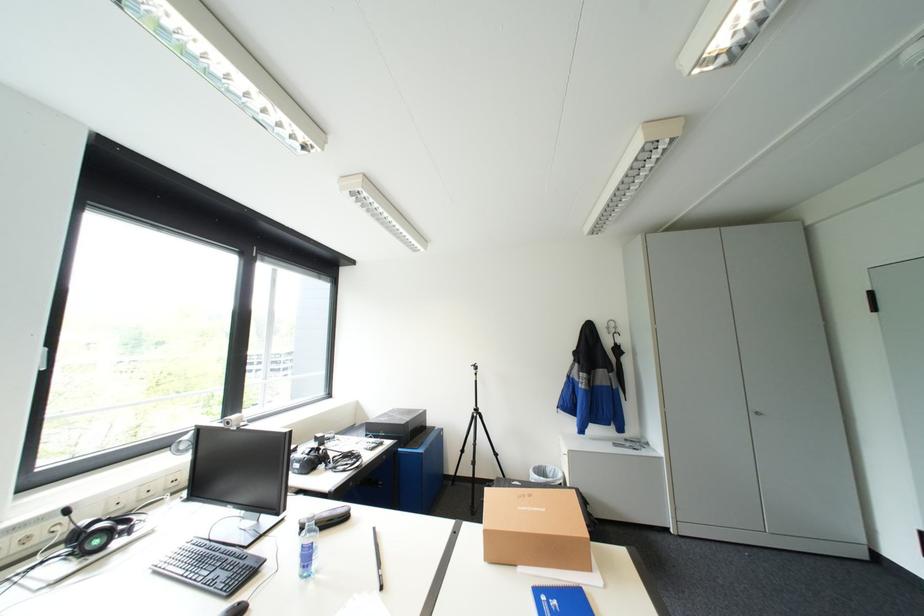
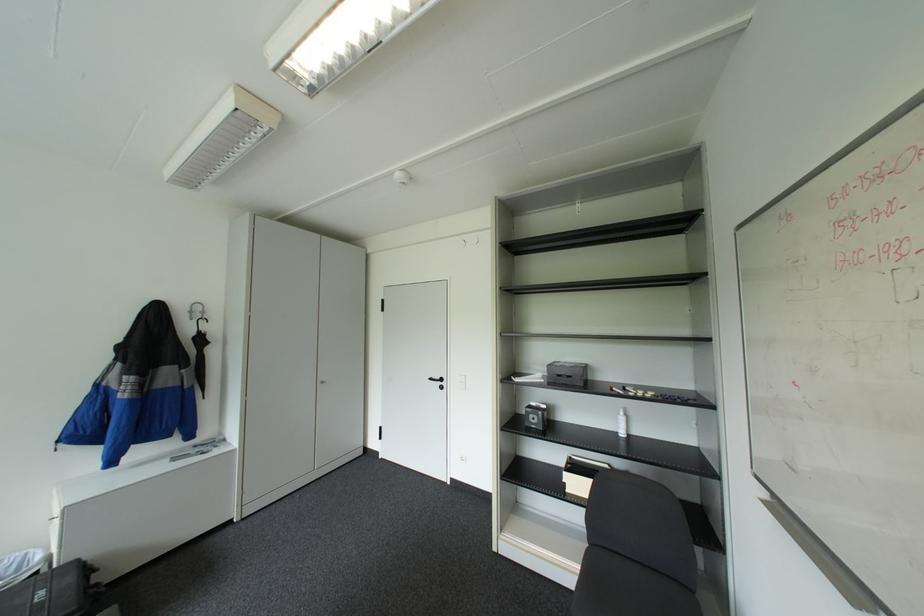
Question: The camera is either moving clockwise (left) or counter-clockwise (right) around the object. The first image is from the beginning of the video and the second image is from the end. Is the camera moving left or right when shooting the video?

Choices:
 (A) Left
 (B) Right

Answer: (A)